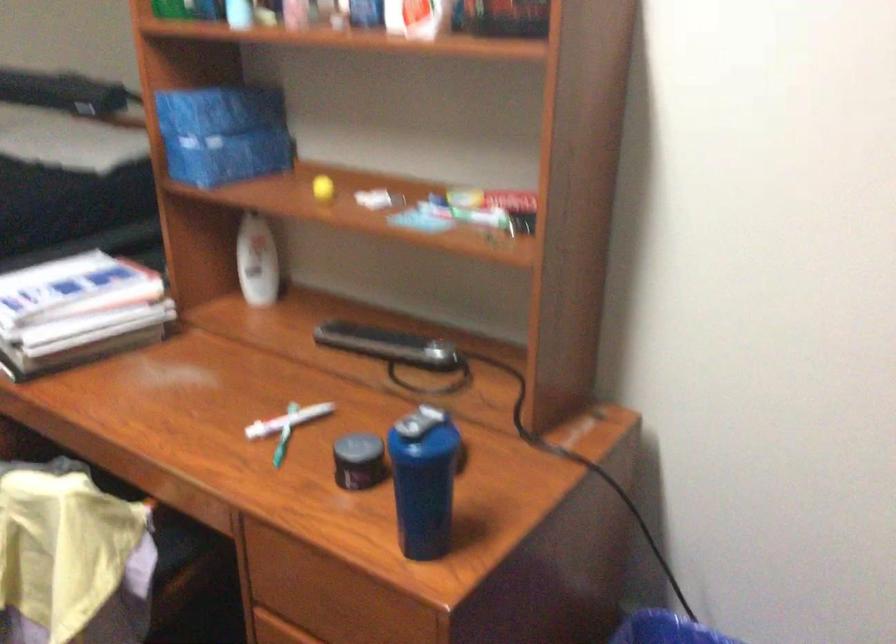
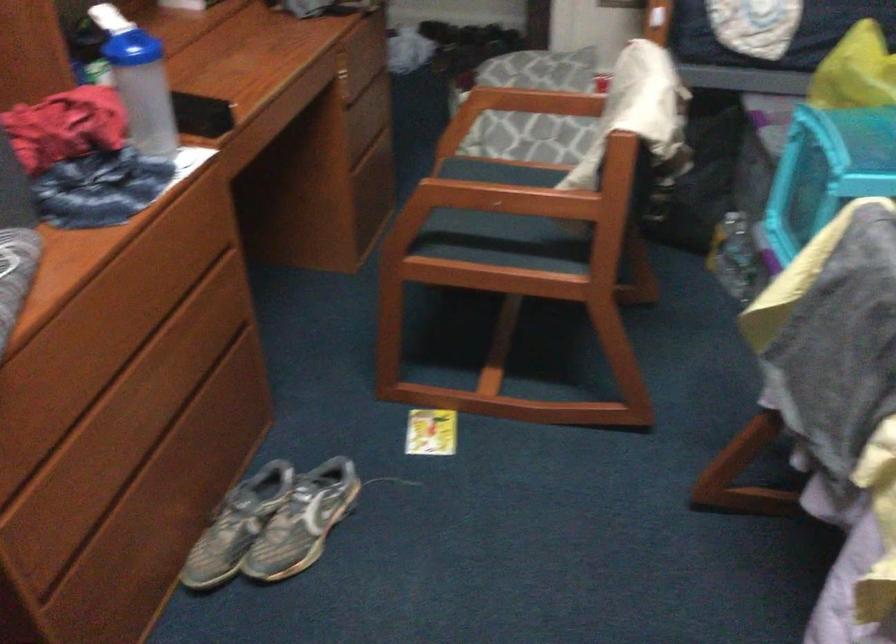
First-person continuous shooting, in which direction is the camera rotating?

The camera's rotation is toward left-down.